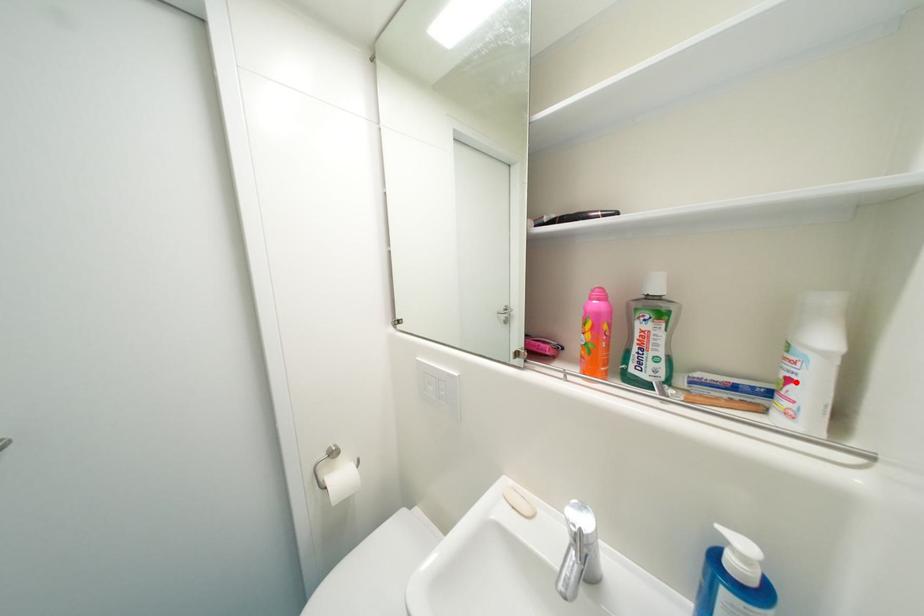
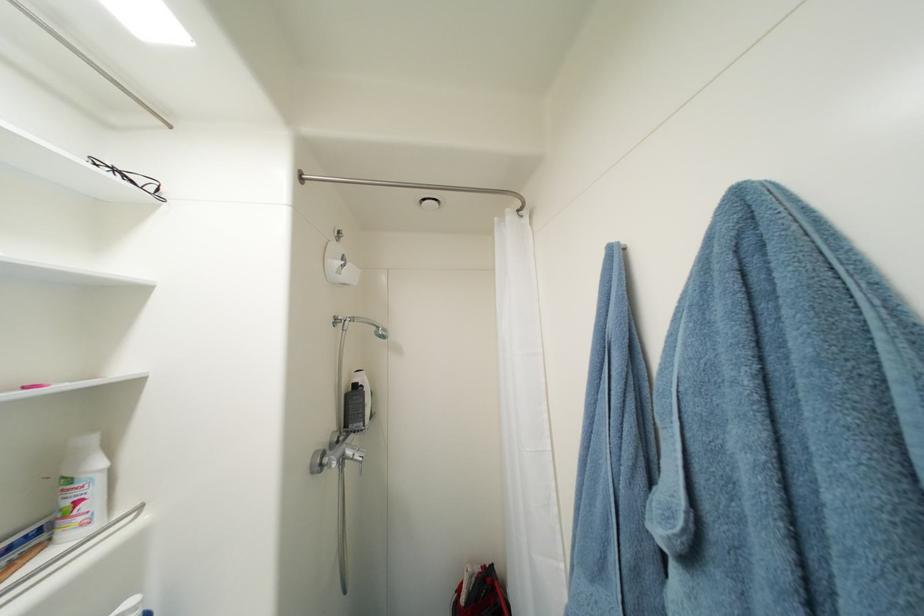
The point at the highlighted location is marked in the first image. Where is the corresponding point in the second image?

(84, 504)